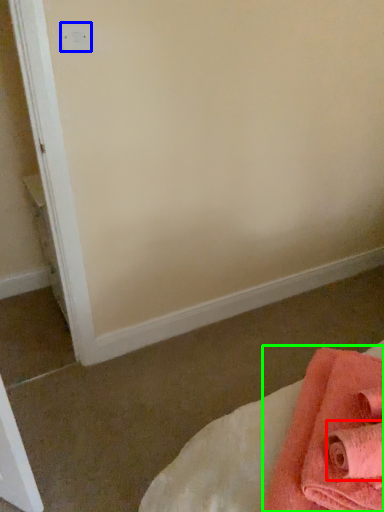
Question: Which object is the farthest from bath towel (highlighted by a red box)? Choose among these: electric outlet (highlighted by a blue box) or towel (highlighted by a green box).

Choices:
 (A) electric outlet
 (B) towel

Answer: (A)